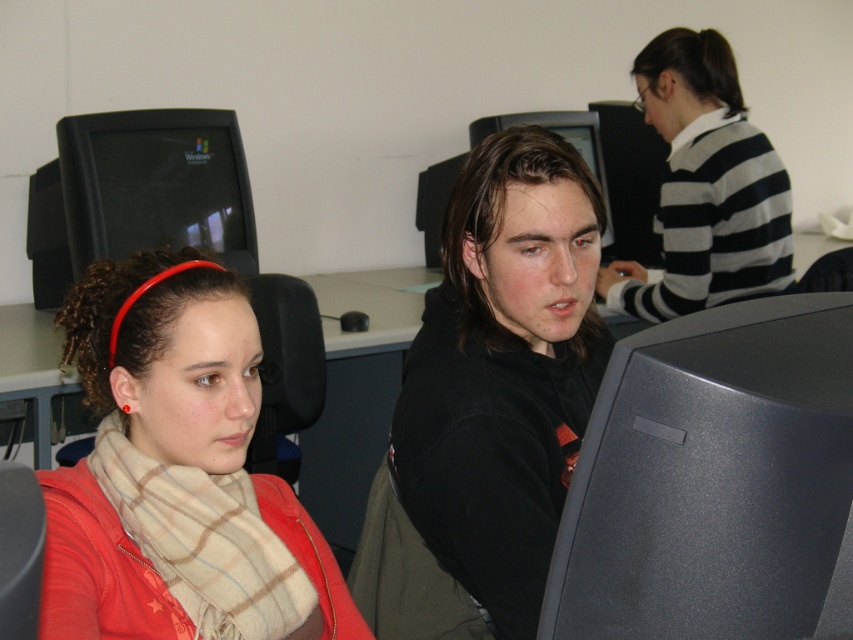
You are a student in the classroom and need to choose a monitor to work on. Which monitor, the matte black monitor at center or the black glossy monitor at center, would you choose if you want a larger screen?

The black glossy monitor at center is larger than the matte black monitor at center, so you should choose the black glossy monitor at center.

You are standing at the origin point of the room. Where is the striped sweater at upper right located?

The striped sweater at upper right is located at point 0.292 on the x axis and 0.826 on the y axis.